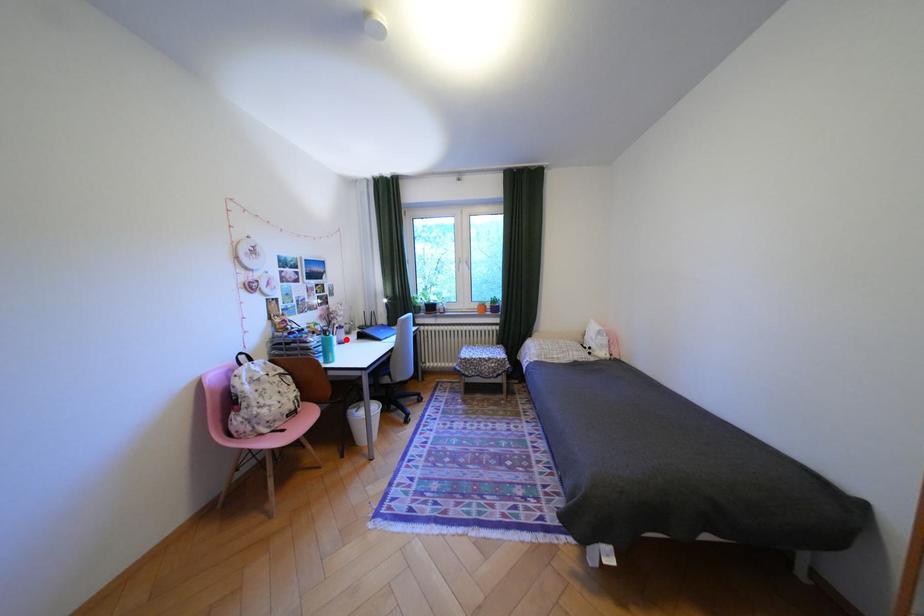
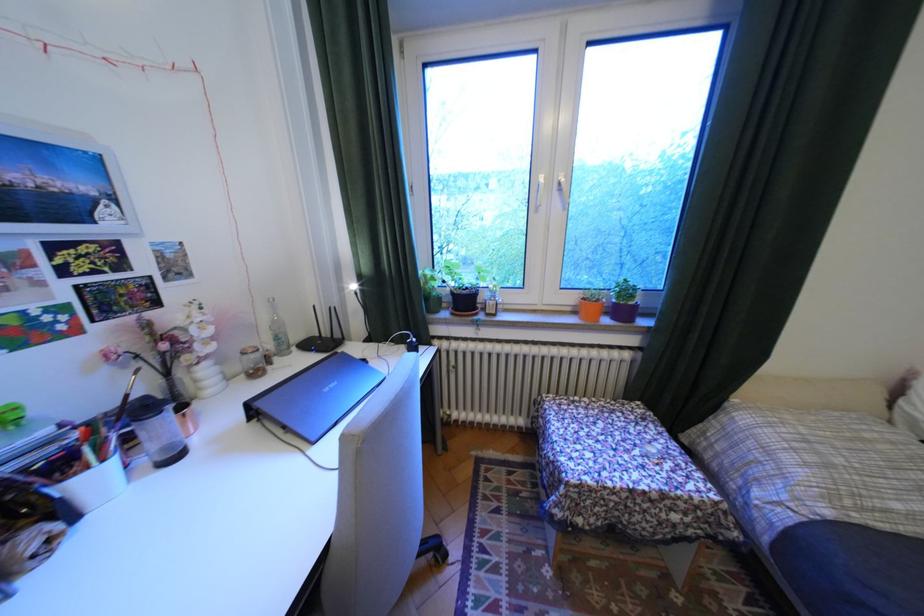
The point at the highlighted location is marked in the first image. Where is the corresponding point in the second image?

(106, 479)